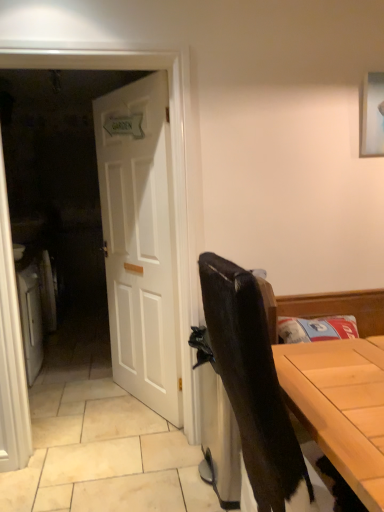
Question: Should I look upward or downward to see white wooden door at center?

Choices:
 (A) up
 (B) down

Answer: (A)

Question: From a real-world perspective, is white wooden door at center on white wooden door at left?

Choices:
 (A) no
 (B) yes

Answer: (A)

Question: Considering the relative sizes of white wooden door at center and white wooden door at left in the image provided, is white wooden door at center taller than white wooden door at left?

Choices:
 (A) no
 (B) yes

Answer: (A)

Question: Considering the relative positions of white wooden door at center and white wooden door at left in the image provided, is white wooden door at center to the left of white wooden door at left from the viewer's perspective?

Choices:
 (A) no
 (B) yes

Answer: (A)

Question: From the image's perspective, is white wooden door at center located beneath white wooden door at left?

Choices:
 (A) no
 (B) yes

Answer: (A)

Question: From the image's perspective, is white wooden door at center above white wooden door at left?

Choices:
 (A) yes
 (B) no

Answer: (A)

Question: Is white wooden door at center beside white wooden door at left?

Choices:
 (A) yes
 (B) no

Answer: (B)

Question: From the image's perspective, is matte black chair at right over white wooden door at center?

Choices:
 (A) no
 (B) yes

Answer: (A)

Question: Can you confirm if matte black chair at right is smaller than white wooden door at center?

Choices:
 (A) yes
 (B) no

Answer: (B)

Question: From a real-world perspective, is matte black chair at right located higher than white wooden door at center?

Choices:
 (A) yes
 (B) no

Answer: (B)

Question: Is matte black chair at right looking in the opposite direction of white wooden door at center?

Choices:
 (A) no
 (B) yes

Answer: (A)

Question: Is white wooden door at center located within matte black chair at right?

Choices:
 (A) yes
 (B) no

Answer: (B)

Question: Does matte black chair at right appear on the right side of white wooden door at center?

Choices:
 (A) no
 (B) yes

Answer: (B)

Question: Can you confirm if white wooden door at left is shorter than white wooden door at center?

Choices:
 (A) no
 (B) yes

Answer: (A)